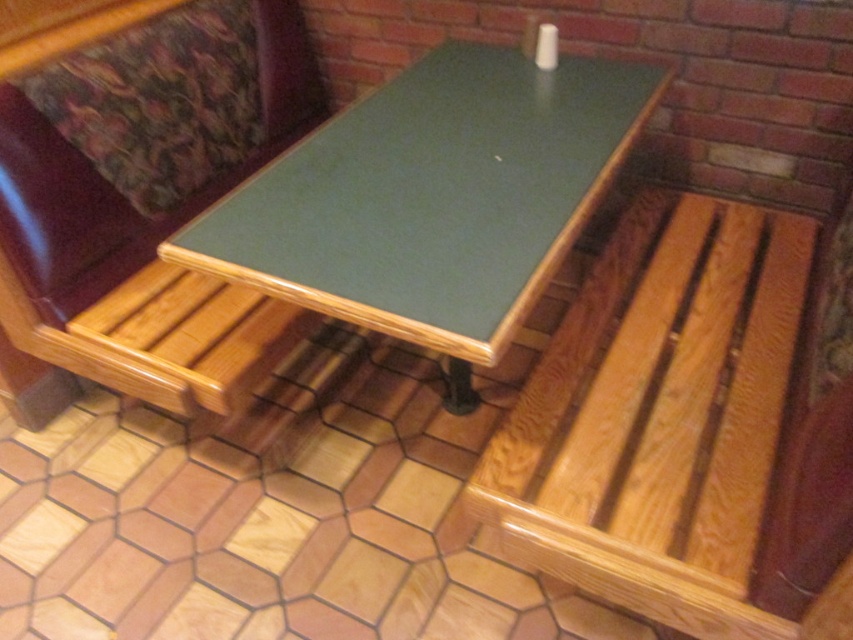
Who is higher up, light brown wood bench at lower right or green laminate table at center?

Positioned higher is green laminate table at center.

Can you confirm if light brown wood bench at lower right is bigger than green laminate table at center?

No.

Does point (726, 588) come closer to viewer compared to point (352, 218)?

Yes.

In order to click on light brown wood bench at lower right in this screenshot , I will do click(x=683, y=433).

Is green laminate table at center wider than wooden bench at center?

Indeed, green laminate table at center has a greater width compared to wooden bench at center.

Can you confirm if green laminate table at center is shorter than wooden bench at center?

Indeed, green laminate table at center has a lesser height compared to wooden bench at center.

Where is `green laminate table at center`? The width and height of the screenshot is (853, 640). green laminate table at center is located at coordinates (433, 196).

Measure the distance between light brown wood bench at lower right and wooden bench at center.

light brown wood bench at lower right is 34.12 inches away from wooden bench at center.

Is light brown wood bench at lower right bigger than wooden bench at center?

No.

Which is in front, point (724, 273) or point (57, 196)?

Positioned in front is point (57, 196).

Image resolution: width=853 pixels, height=640 pixels. Find the location of `light brown wood bench at lower right`. light brown wood bench at lower right is located at coordinates (683, 433).